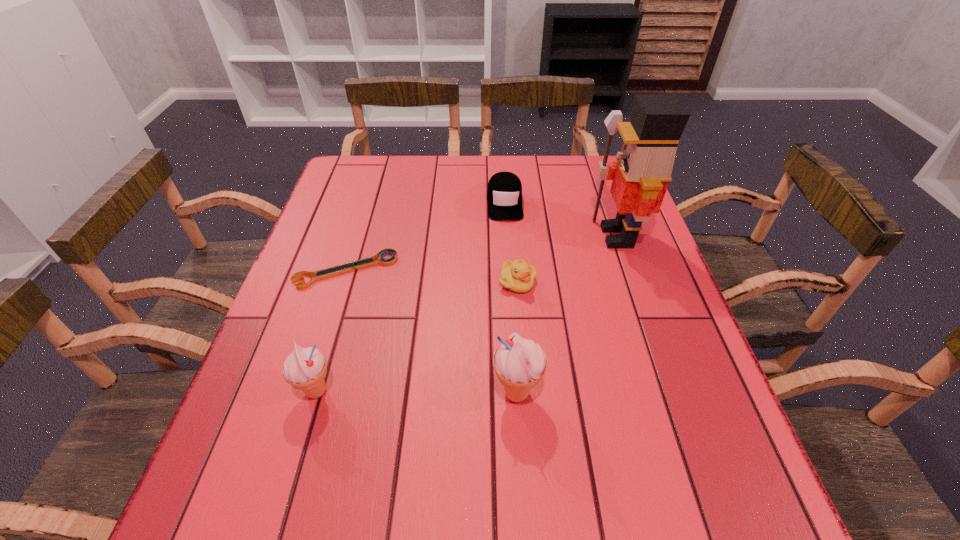
You are a GUI agent. You are given a task and a screenshot of the screen. Output one action in this format:
    pyautogui.click(x=<x>, y=<y>)
    Task: Click on the free space in the image that satisfies the following two spatial constraints: 1. in front of the tallest object holding the staff; 2. on the front-facing side of the duckling
    The image size is (960, 540).
    Given the screenshot: What is the action you would take?
    pyautogui.click(x=632, y=282)

Locate an element on the screen. The height and width of the screenshot is (540, 960). vacant space that satisfies the following two spatial constraints: 1. in front of the nutcracker holding the staff; 2. on the front side of the right icecream is located at coordinates (670, 393).